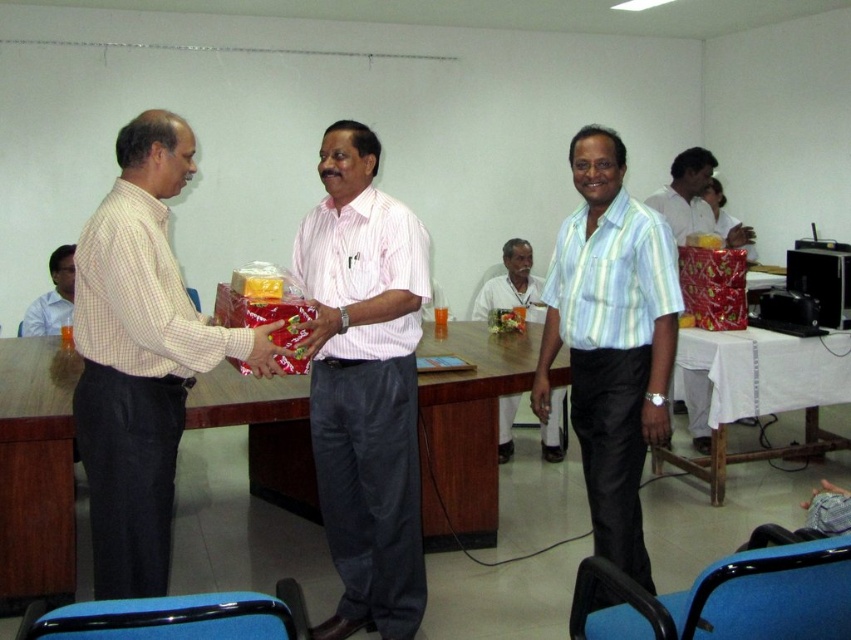
The image size is (851, 640). What do you see at coordinates (141, 356) in the screenshot?
I see `matte white shirt at left` at bounding box center [141, 356].

The width and height of the screenshot is (851, 640). I want to click on matte white shirt at left, so click(141, 356).

Identify the location of matte white shirt at left. This screenshot has height=640, width=851. (141, 356).

Is light blue striped shirt at center behind white fabric shirt at center?

No, it is not.

Which is above, light blue striped shirt at center or white fabric shirt at center?

Positioned higher is white fabric shirt at center.

Describe the element at coordinates (610, 340) in the screenshot. I see `light blue striped shirt at center` at that location.

Locate an element on the screen. This screenshot has width=851, height=640. light blue striped shirt at center is located at coordinates (610, 340).

This screenshot has width=851, height=640. What are the coordinates of `matte white shirt at left` in the screenshot? It's located at (141, 356).

Is point (106, 474) closer to viewer compared to point (43, 355)?

Yes, point (106, 474) is closer to viewer.

Locate an element on the screen. The height and width of the screenshot is (640, 851). matte white shirt at left is located at coordinates (141, 356).